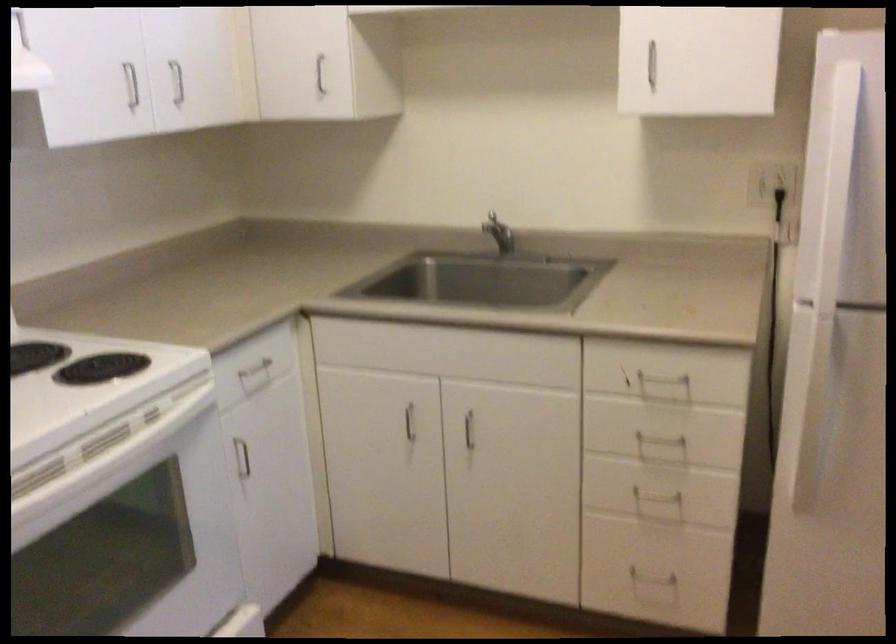
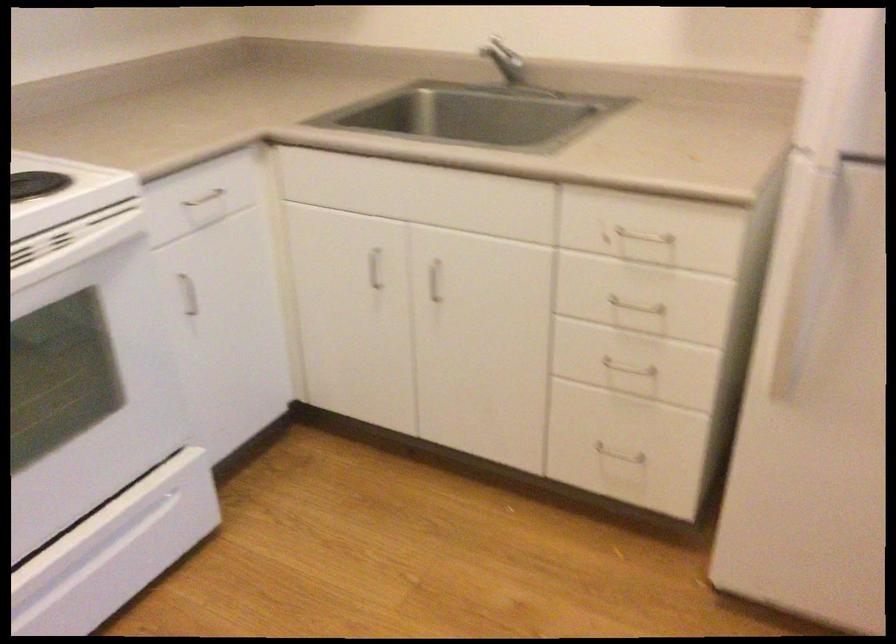
Find the pixel in the second image that matches (x=659, y=379) in the first image.

(639, 236)